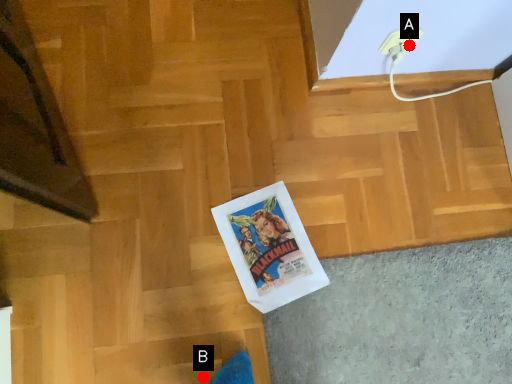
Question: Two points are circled on the image, labeled by A and B beside each circle. Which point appears closest to the camera in this image?

Choices:
 (A) A is closer
 (B) B is closer

Answer: (A)